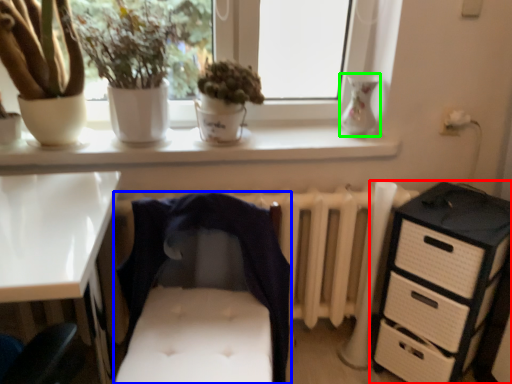
Question: Based on their relative distances, which object is farther from chest of drawers (highlighted by a red box)? Choose from infant bed (highlighted by a blue box) and vase (highlighted by a green box).

Choices:
 (A) infant bed
 (B) vase

Answer: (B)